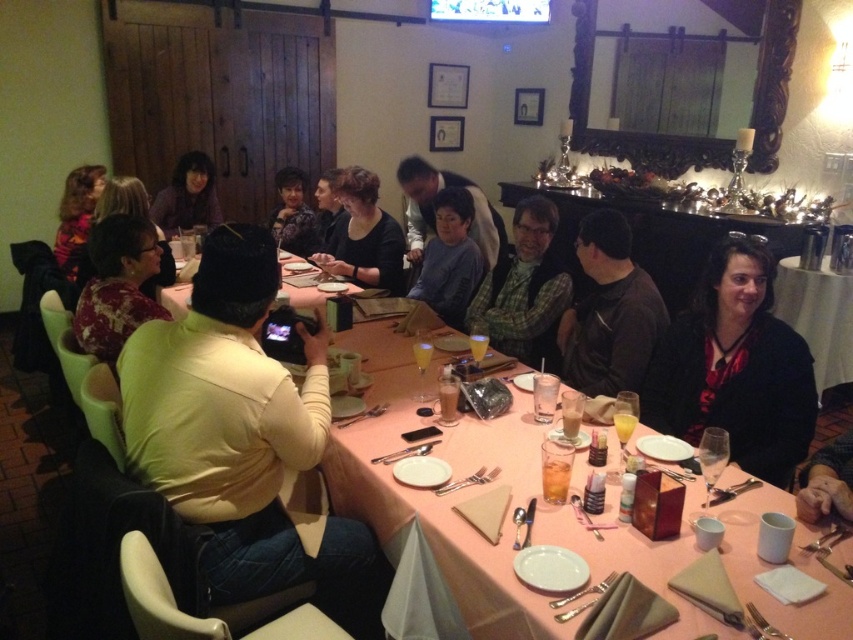
Question: Does light brown leather jacket at center appear on the left side of matte black table at lower right?

Choices:
 (A) no
 (B) yes

Answer: (B)

Question: Among these points, which one is nearest to the camera?

Choices:
 (A) (129, 209)
 (B) (67, 250)

Answer: (A)

Question: Can you confirm if matte black shirt at center is thinner than floral sweater at left?

Choices:
 (A) yes
 (B) no

Answer: (B)

Question: Among these objects, which one is farthest from the camera?

Choices:
 (A) printed fabric blouse at left
 (B) light brown leather jacket at center

Answer: (A)

Question: Among these objects, which one is farthest from the camera?

Choices:
 (A) matte purple shirt at upper left
 (B) printed fabric blouse at left
 (C) matte black shirt at center

Answer: (A)

Question: Does light brown leather jacket at center appear on the right side of black matte jacket at lower right?

Choices:
 (A) no
 (B) yes

Answer: (A)